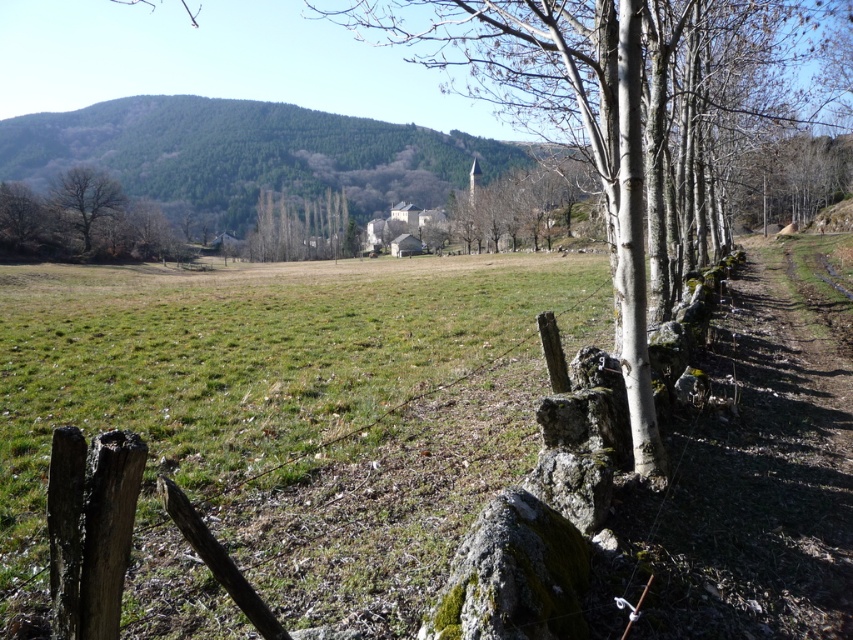
You are standing in the middle of the image and want to walk towards the weathered wood fence at lower left. Which direction should you face to head straight towards it?

You should face towards the lower left direction to head straight towards the weathered wood fence at lower left, as its 2D location is at point [90,528].

You are a painter setting up your easel to capture the rural landscape. You want to paint both the weathered wood fence at lower left and the brown rough tree at left. Based on their sizes, which object should you place closer to the center of your painting to emphasize its prominence?

The brown rough tree at left is larger than the weathered wood fence at lower left, so to emphasize its prominence, you should place the brown rough tree at left closer to the center of your painting.